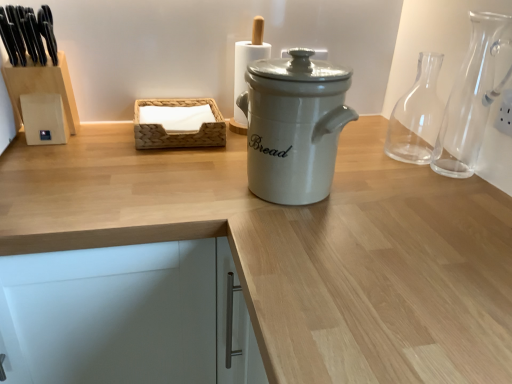
In order to face white matte cabinet at lower left, should I rotate leftwards or rightwards?

Rotate left and turn 22.032 degrees.

How much space does transparent glass carafe at right, the 1th glass vase in the front-to-back sequence, occupy horizontally?

The width of transparent glass carafe at right, the 1th glass vase in the front-to-back sequence, is 5.01 inches.

What do you see at coordinates (178, 123) in the screenshot?
I see `woven wood tissue box at center` at bounding box center [178, 123].

Image resolution: width=512 pixels, height=384 pixels. Find the location of `transparent glass carafe at right, the 1th glass vase when ordered from back to front`. transparent glass carafe at right, the 1th glass vase when ordered from back to front is located at coordinates (417, 115).

This screenshot has height=384, width=512. In order to click on white plastic electric outlet at upper right in this screenshot , I will do `click(505, 114)`.

Is white ceramic bread bin at center thinner than white matte cabinet at lower left?

Yes.

Which is correct: white ceramic bread bin at center is inside white matte cabinet at lower left, or outside of it?

white ceramic bread bin at center is not inside white matte cabinet at lower left, it's outside.

In the image, is white ceramic bread bin at center positioned in front of or behind white matte cabinet at lower left?

In the image, white ceramic bread bin at center appears behind white matte cabinet at lower left.

How many degrees apart are the facing directions of white ceramic bread bin at center and white matte cabinet at lower left?

The facing directions of white ceramic bread bin at center and white matte cabinet at lower left are 1.12 degrees apart.

Measure the distance from woven wood tissue box at center to white ceramic bread bin at center.

They are 29.53 centimeters apart.

Is white ceramic bread bin at center at the back of woven wood tissue box at center?

woven wood tissue box at center does not have its back to white ceramic bread bin at center.

Would you say woven wood tissue box at center is to the left or to the right of white ceramic bread bin at center in the picture?

woven wood tissue box at center is positioned on white ceramic bread bin at center's left side.

Considering the sizes of woven wood tissue box at center and white ceramic bread bin at center in the image, is woven wood tissue box at center bigger or smaller than white ceramic bread bin at center?

Clearly, woven wood tissue box at center is smaller in size than white ceramic bread bin at center.

Measure the distance from transparent glass carafe at right, positioned as the 2th glass vase in back-to-front order, to transparent glass carafe at right, acting as the 2th glass vase starting from the front.

transparent glass carafe at right, positioned as the 2th glass vase in back-to-front order, and transparent glass carafe at right, acting as the 2th glass vase starting from the front, are 4.35 inches apart from each other.

Are transparent glass carafe at right, the 1th glass vase in the front-to-back sequence, and transparent glass carafe at right, acting as the 2th glass vase starting from the front, making contact?

transparent glass carafe at right, the 1th glass vase in the front-to-back sequence, and transparent glass carafe at right, acting as the 2th glass vase starting from the front, are not in contact.

Find the location of a particular element. This screenshot has width=512, height=384. glass vase that appears behind the transparent glass carafe at right, positioned as the 2th glass vase in back-to-front order is located at coordinates (417, 115).

Where is `electric outlet lying behind the transparent glass carafe at right, positioned as the 2th glass vase in back-to-front order`? electric outlet lying behind the transparent glass carafe at right, positioned as the 2th glass vase in back-to-front order is located at coordinates (505, 114).

Is transparent glass carafe at right, the 1th glass vase in the front-to-back sequence, spatially inside white plastic electric outlet at upper right, or outside of it?

transparent glass carafe at right, the 1th glass vase in the front-to-back sequence, is not enclosed by white plastic electric outlet at upper right.

Based on the photo, from a real-world perspective, which is physically above, white matte cabinet at lower left or woven wood tissue box at center?

In real-world perspective, woven wood tissue box at center is above.

From the image's perspective, is white matte cabinet at lower left located above or below woven wood tissue box at center?

white matte cabinet at lower left is situated lower than woven wood tissue box at center in the image.

Would you say white matte cabinet at lower left is a long distance from woven wood tissue box at center?

No, white matte cabinet at lower left is not far from woven wood tissue box at center.

Can you confirm if white matte cabinet at lower left is bigger than transparent glass carafe at right, acting as the 2th glass vase starting from the front?

Yes, white matte cabinet at lower left is bigger than transparent glass carafe at right, acting as the 2th glass vase starting from the front.

Does white matte cabinet at lower left touch transparent glass carafe at right, the 1th glass vase when ordered from back to front?

white matte cabinet at lower left and transparent glass carafe at right, the 1th glass vase when ordered from back to front, are not in contact.

Between white matte cabinet at lower left and transparent glass carafe at right, the 1th glass vase when ordered from back to front, which one has less height?

With less height is transparent glass carafe at right, the 1th glass vase when ordered from back to front.

Identify the location of cabinetry below the transparent glass carafe at right, the 1th glass vase when ordered from back to front (from a real-world perspective). (125, 316).

Which is in front, white matte cabinet at lower left or transparent glass carafe at right, the 1th glass vase in the front-to-back sequence?

white matte cabinet at lower left.

Is white matte cabinet at lower left to the left or to the right of transparent glass carafe at right, the 1th glass vase in the front-to-back sequence, in the image?

white matte cabinet at lower left is positioned on transparent glass carafe at right, the 1th glass vase in the front-to-back sequence,'s left side.

Are white matte cabinet at lower left and transparent glass carafe at right, positioned as the 2th glass vase in back-to-front order, located far from each other?

No, there isn't a large distance between white matte cabinet at lower left and transparent glass carafe at right, positioned as the 2th glass vase in back-to-front order.

Is white matte cabinet at lower left wider or thinner than transparent glass carafe at right, the 1th glass vase in the front-to-back sequence?

Considering their sizes, white matte cabinet at lower left looks broader than transparent glass carafe at right, the 1th glass vase in the front-to-back sequence.

Identify the location of kitchen appliance behind the white matte cabinet at lower left. (294, 126).

Where is `basket above the white ceramic bread bin at center (from the image's perspective)`? The width and height of the screenshot is (512, 384). basket above the white ceramic bread bin at center (from the image's perspective) is located at coordinates (178, 123).

Considering their positions, is transparent glass carafe at right, the 1th glass vase when ordered from back to front, positioned closer to woven wood tissue box at center than transparent glass carafe at right, positioned as the 2th glass vase in back-to-front order?

transparent glass carafe at right, the 1th glass vase when ordered from back to front, is closer to woven wood tissue box at center.

Considering their positions, is transparent glass carafe at right, the 1th glass vase in the front-to-back sequence, positioned further to woven wood tissue box at center than transparent glass carafe at right, the 1th glass vase when ordered from back to front?

The object further to woven wood tissue box at center is transparent glass carafe at right, the 1th glass vase in the front-to-back sequence.

Considering their positions, is transparent glass carafe at right, acting as the 2th glass vase starting from the front, positioned closer to white ceramic bread bin at center than woven wood tissue box at center?

woven wood tissue box at center is closer to white ceramic bread bin at center.

When comparing their distances from white matte cabinet at lower left, does transparent glass carafe at right, positioned as the 2th glass vase in back-to-front order, or woven wood tissue box at center seem further?

The object further to white matte cabinet at lower left is transparent glass carafe at right, positioned as the 2th glass vase in back-to-front order.

Considering their positions, is white matte cabinet at lower left positioned closer to white ceramic bread bin at center than white plastic electric outlet at upper right?

white matte cabinet at lower left.

Which object lies further to the anchor point white matte cabinet at lower left, white plastic electric outlet at upper right or transparent glass carafe at right, the 1th glass vase in the front-to-back sequence?

white plastic electric outlet at upper right.

From the image, which object appears to be farther from transparent glass carafe at right, the 1th glass vase when ordered from back to front, white ceramic bread bin at center or woven wood tissue box at center?

The object further to transparent glass carafe at right, the 1th glass vase when ordered from back to front, is woven wood tissue box at center.

Based on the photo, when comparing their distances from transparent glass carafe at right, the 1th glass vase in the front-to-back sequence, does transparent glass carafe at right, acting as the 2th glass vase starting from the front, or white matte cabinet at lower left seem closer?

The object closer to transparent glass carafe at right, the 1th glass vase in the front-to-back sequence, is transparent glass carafe at right, acting as the 2th glass vase starting from the front.

The width and height of the screenshot is (512, 384). I want to click on kitchen appliance between white matte cabinet at lower left and transparent glass carafe at right, acting as the 2th glass vase starting from the front, from left to right, so click(x=294, y=126).

Locate an element on the screen. kitchen appliance located between woven wood tissue box at center and transparent glass carafe at right, positioned as the 2th glass vase in back-to-front order, in the left-right direction is located at coordinates (294, 126).

In order to click on glass vase between woven wood tissue box at center and transparent glass carafe at right, positioned as the 2th glass vase in back-to-front order, in the horizontal direction in this screenshot , I will do `click(417, 115)`.

Locate an element on the screen. The height and width of the screenshot is (384, 512). basket between white matte cabinet at lower left and transparent glass carafe at right, positioned as the 2th glass vase in back-to-front order, from left to right is located at coordinates (178, 123).